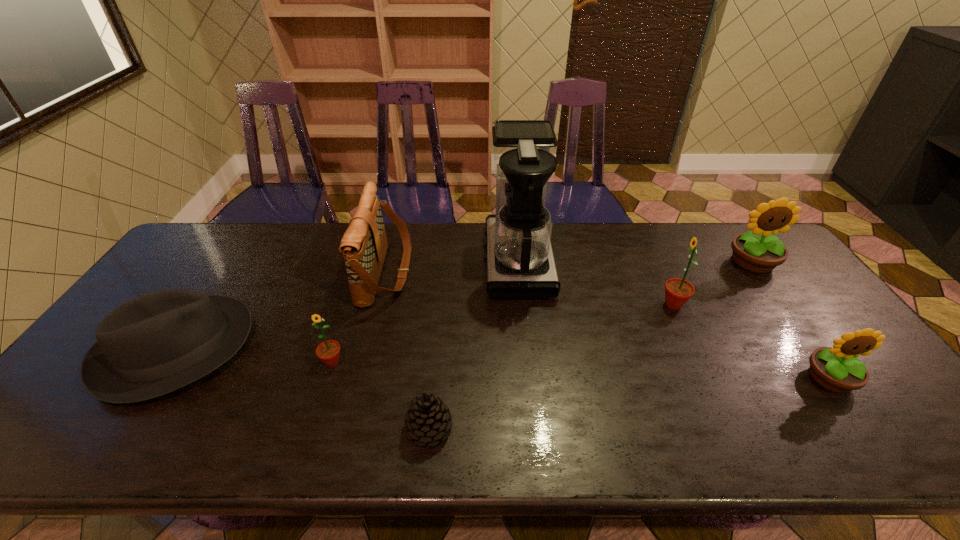
This screenshot has width=960, height=540. I want to click on object that is at the left edge, so click(x=154, y=344).

At what (x,y) coordinates should I click in order to perform the action: click on object that is at the far right corner. Please return your answer as a coordinate pair (x, y). Image resolution: width=960 pixels, height=540 pixels. Looking at the image, I should click on (759, 251).

Where is `vacant space at the far edge`? vacant space at the far edge is located at coordinates (425, 255).

At what (x,y) coordinates should I click in order to perform the action: click on vacant space at the near edge of the desktop. Please return your answer as a coordinate pair (x, y). The height and width of the screenshot is (540, 960). Looking at the image, I should click on (802, 451).

Find the location of a particular element. free space at the right edge of the desktop is located at coordinates (870, 413).

Locate an element on the screen. This screenshot has width=960, height=540. free space at the far left corner of the desktop is located at coordinates (196, 249).

This screenshot has height=540, width=960. Identify the location of free space between the shoulder bag and the nearer green sunflower. (359, 317).

The height and width of the screenshot is (540, 960). In order to click on empty space that is in between the smaller yellow sunflower and the second farthest sunflower in this screenshot , I will do `click(752, 341)`.

I want to click on free space between the pinecone and the seventh tallest object, so click(302, 388).

Find the location of a particular element. This screenshot has width=960, height=540. free space that is in between the nearer yellow sunflower and the leftmost sunflower is located at coordinates (581, 370).